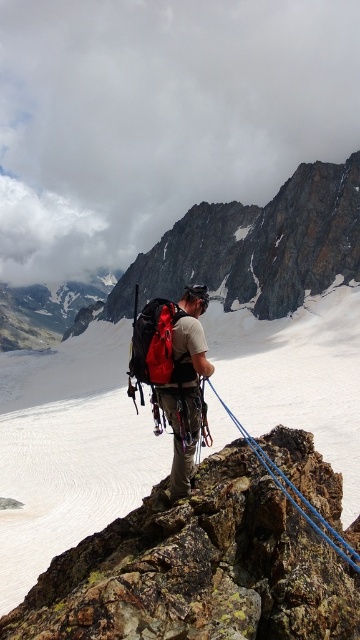
Between rusty rock at center and blue nylon rope at center, which one is positioned lower?

rusty rock at center is lower down.

Is rusty rock at center to the left of blue nylon rope at center from the viewer's perspective?

Indeed, rusty rock at center is positioned on the left side of blue nylon rope at center.

Does point (164, 600) come closer to viewer compared to point (338, 552)?

That is True.

The height and width of the screenshot is (640, 360). I want to click on rusty rock at center, so click(x=198, y=570).